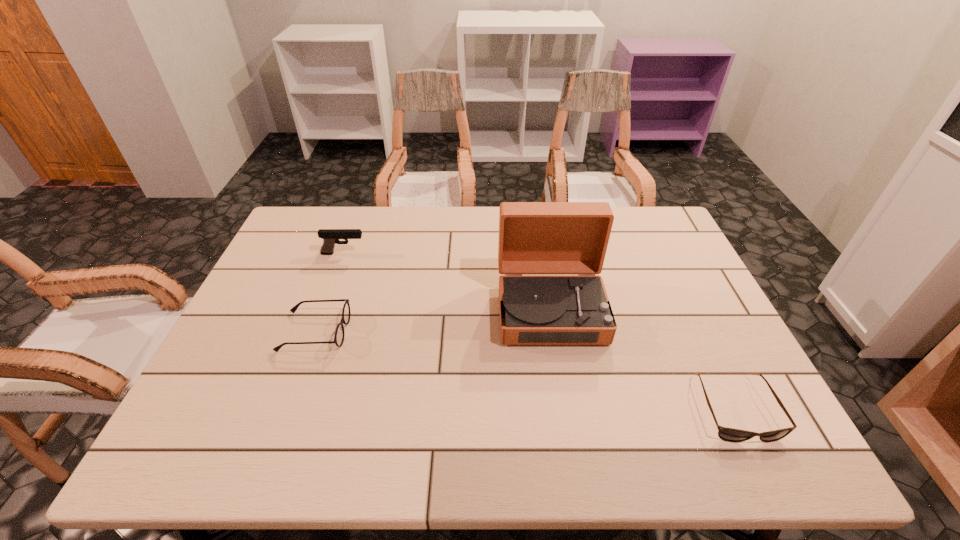
You are a GUI agent. You are given a task and a screenshot of the screen. Output one action in this format:
    pyautogui.click(x=<x>, y=<y>)
    Task: Click on the unoccupied position between the third object from left to right and the farthest object
    
    Given the screenshot: What is the action you would take?
    pyautogui.click(x=447, y=282)

This screenshot has width=960, height=540. Find the location of `vacant area between the phonograph record and the pistol`. vacant area between the phonograph record and the pistol is located at coordinates (447, 282).

Where is `free spot between the second object from right to left and the pistol`? Image resolution: width=960 pixels, height=540 pixels. free spot between the second object from right to left and the pistol is located at coordinates (447, 282).

The height and width of the screenshot is (540, 960). I want to click on vacant region between the rightmost object and the tallest object, so coord(642,360).

Where is `vacant area that lies between the pistol and the phonograph record`? The height and width of the screenshot is (540, 960). vacant area that lies between the pistol and the phonograph record is located at coordinates (447, 282).

Locate an element on the screen. free point between the farthest object and the second object from right to left is located at coordinates (447, 282).

Where is `free spot between the phonograph record and the farthest object`? free spot between the phonograph record and the farthest object is located at coordinates click(447, 282).

You are a GUI agent. You are given a task and a screenshot of the screen. Output one action in this format:
    pyautogui.click(x=<x>, y=<y>)
    Task: Click on the free space between the phonograph record and the third tallest object
    Image resolution: width=960 pixels, height=540 pixels.
    Given the screenshot: What is the action you would take?
    pyautogui.click(x=433, y=321)

Identify the location of vacant space in between the spectacles and the second object from right to left. (433, 321).

Where is `free space between the third object from left to right and the pistol`? Image resolution: width=960 pixels, height=540 pixels. free space between the third object from left to right and the pistol is located at coordinates (447, 282).